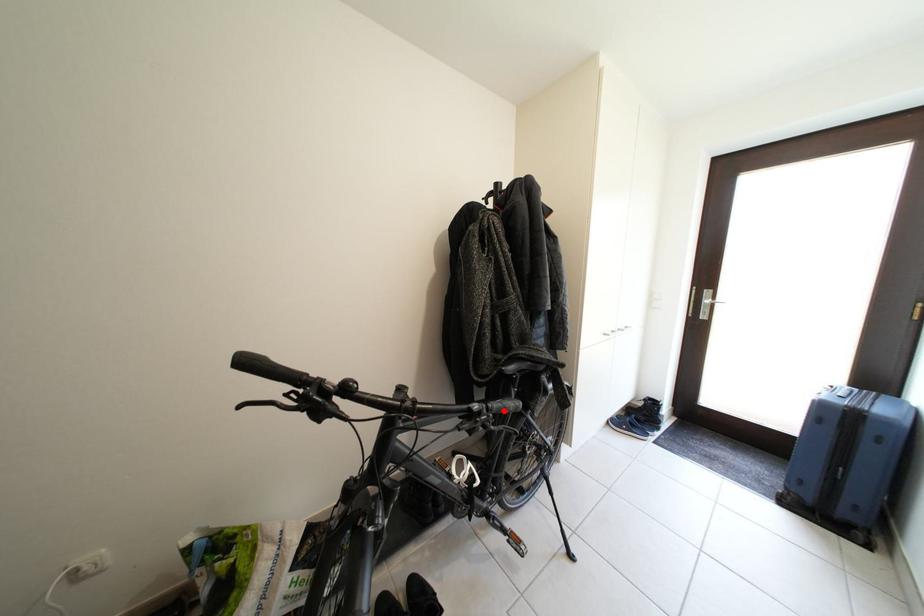
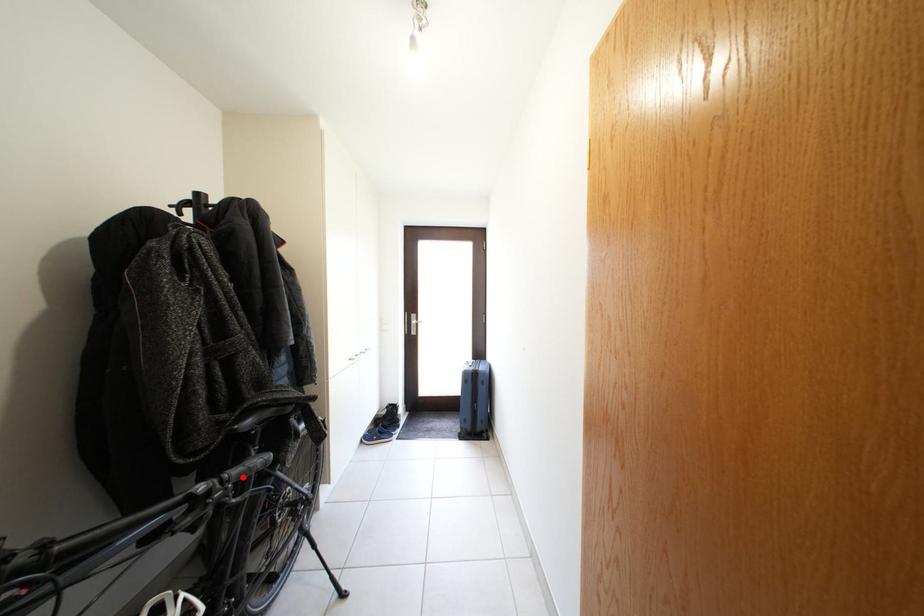
I am providing you with two images of the same scene from different viewpoints. A red point is marked on the first image and another point is marked on the second image. Is the marked point in image1 the same physical position as the marked point in image2?

Yes